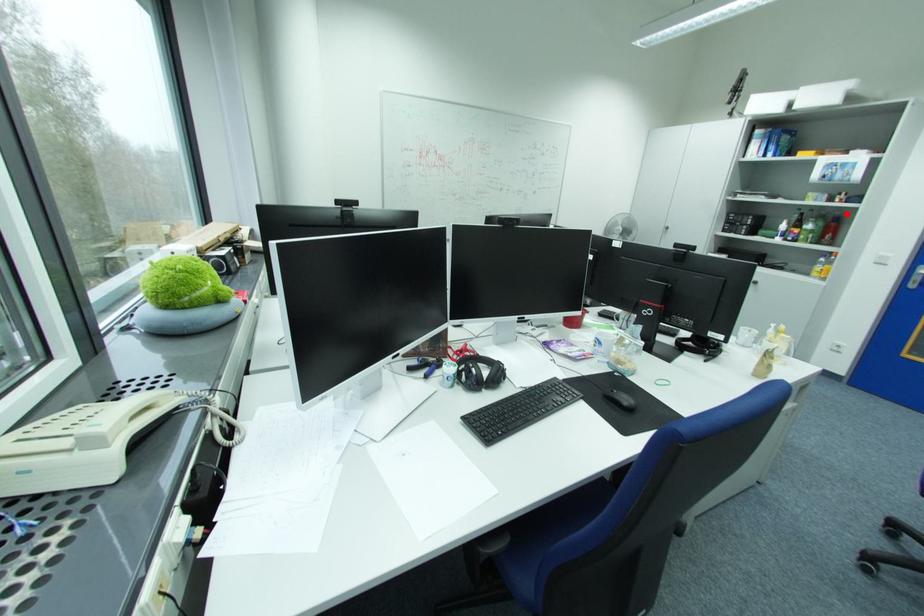
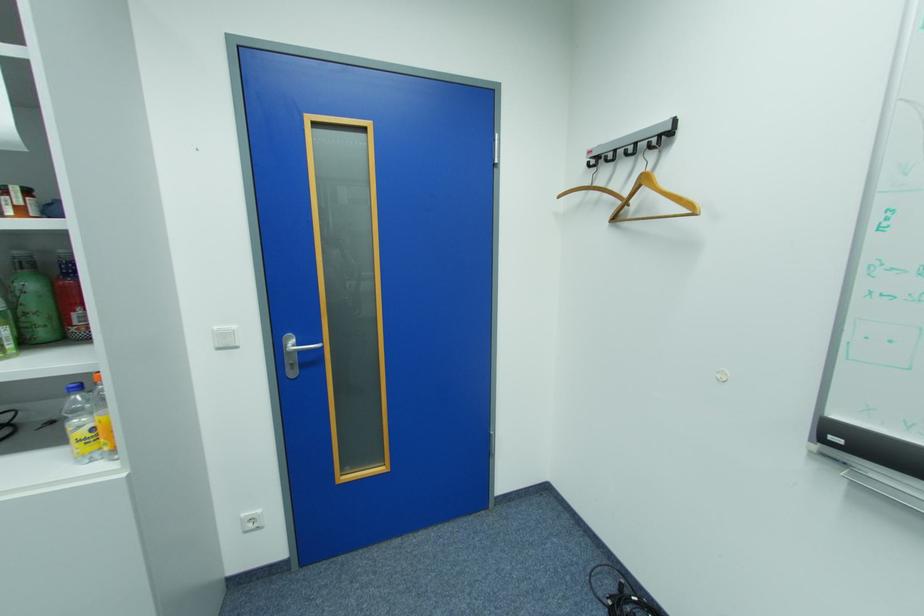
Question: I am providing you with two images of the same scene from different viewpoints. In image1, a red point is highlighted. Considering the same 3D point in image2, which of the following is correct?

Choices:
 (A) It is closer
 (B) It is farther

Answer: (A)